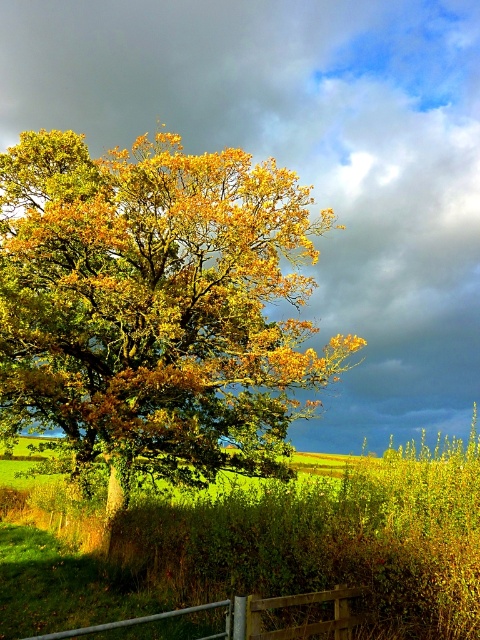
Question: Which of the following is the closest to the observer?

Choices:
 (A) (357, 618)
 (B) (155, 420)

Answer: (A)

Question: Among these points, which one is farthest from the camera?

Choices:
 (A) (180, 353)
 (B) (264, 600)

Answer: (A)

Question: Does golden yellow leaves at center come in front of metallic silver gate at lower center?

Choices:
 (A) yes
 (B) no

Answer: (B)

Question: Which point is closer to the camera taking this photo?

Choices:
 (A) (49, 173)
 (B) (235, 625)

Answer: (B)

Question: Is golden yellow leaves at center bigger than metallic silver gate at lower center?

Choices:
 (A) no
 (B) yes

Answer: (B)

Question: Does golden yellow leaves at center appear over metallic silver gate at lower center?

Choices:
 (A) no
 (B) yes

Answer: (B)